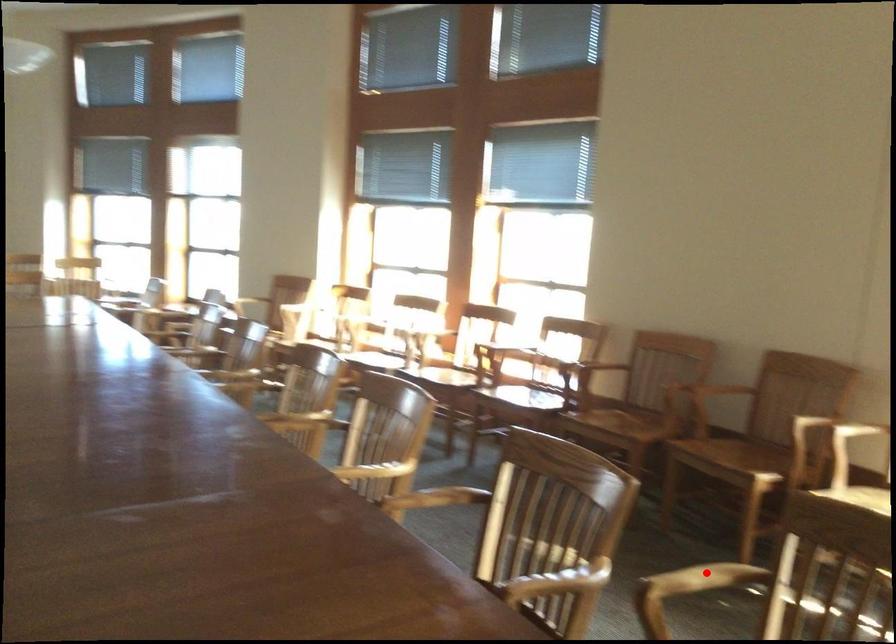
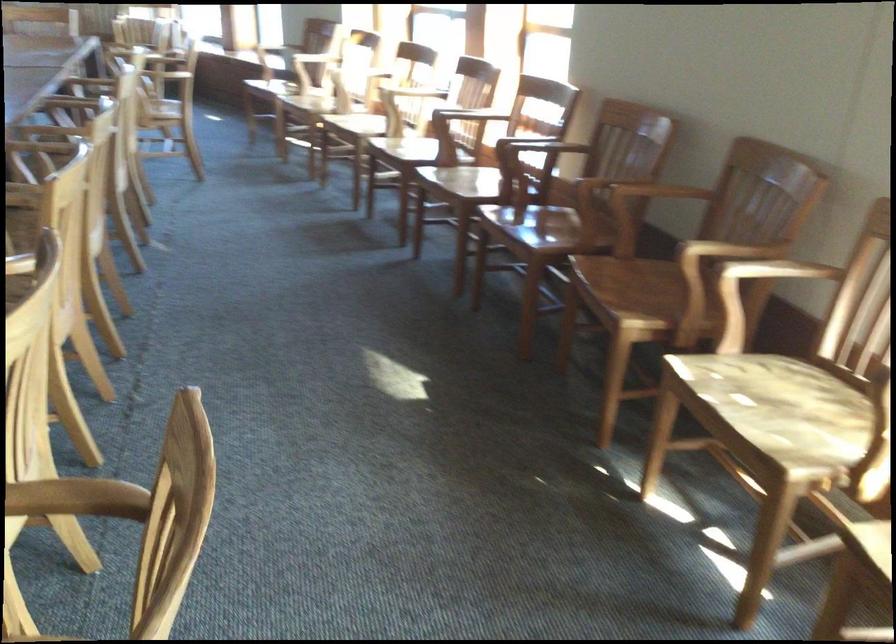
Question: A red point is marked in image1. In image2, is the corresponding 3D point closer to the camera or farther? Reply with the corresponding letter.

Choices:
 (A) The corresponding 3D point is closer.
 (B) The corresponding 3D point is farther.

Answer: (A)